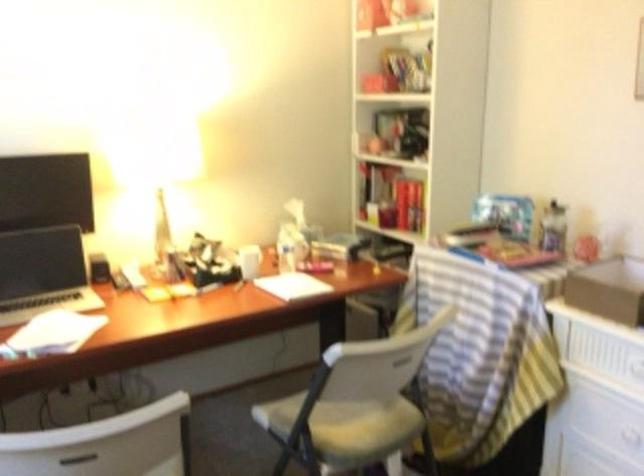
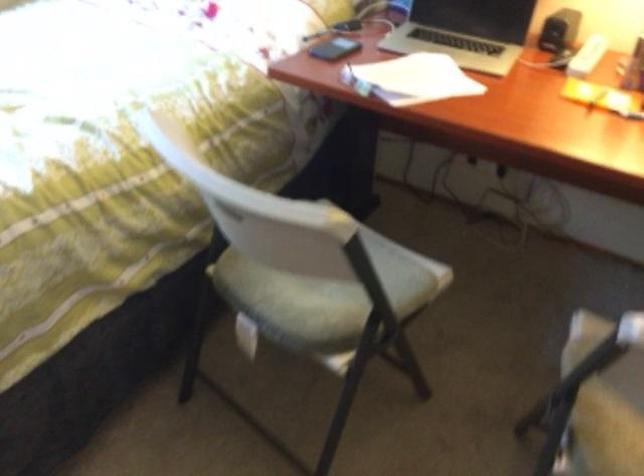
How did the camera likely rotate?

The rotation direction of the camera is left-down.